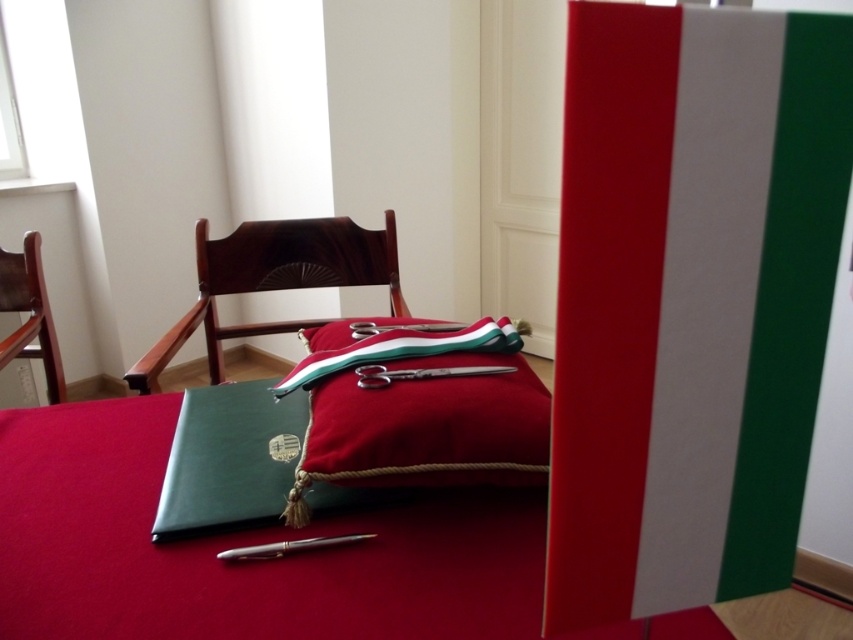
You are standing in front of the ceremonial table and want to place a small decoration exactly halfway between the two points marked as point [479,388] and point [341,246]. Will the decoration be closer to the camera or further away compared to the two points?

The decoration placed halfway between point [479,388] and point [341,246] will be closer to the camera than point [341,246] but further away than point [479,388]. Since point [479,388] is closer to the camera, the midpoint will be between their distances, so it is closer than the farther point but further than the nearer one.

You are a furniture mover tasked with moving the mahogany wood rocking chair at center and the velvet red cushion at center through a doorway that is 1.2 meters wide. Based on their widths, can both items fit through the doorway side by side?

The mahogany wood rocking chair at center might be wider than the velvet red cushion at center, so it is uncertain if both can fit through the doorway side by side. Measure their widths to confirm.

You are a guest at a ceremony and need to move from the wooden chair at left to the velvet red cushion at center. Given that the space between them is 37.56 inches, can you comfortably walk through without needing to squeeze?

The velvet red cushion at center and wooden chair at left are 37.56 inches apart, so yes, you can comfortably walk through the space between them without needing to squeeze since 37.56 inches is approximately 3.13 feet, which provides enough room for a person to move freely.